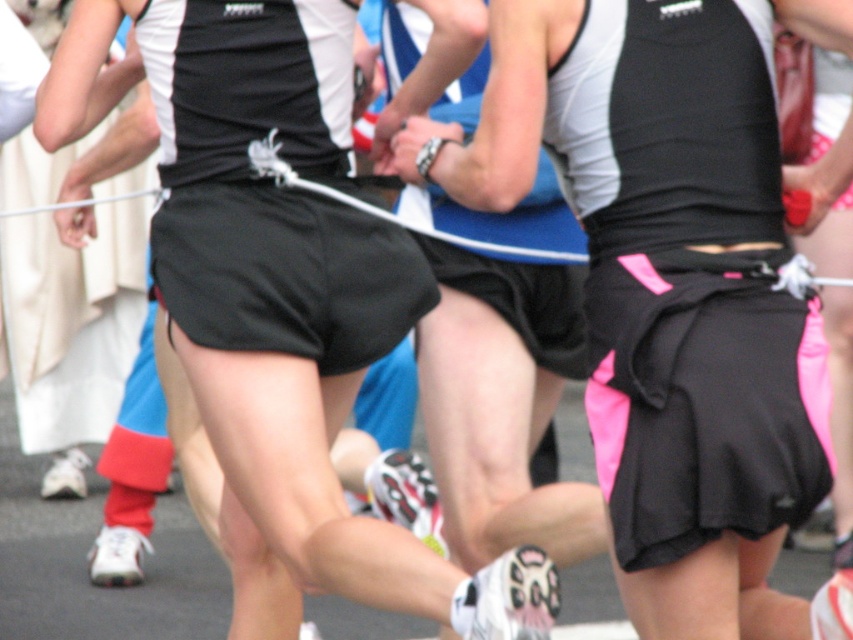
Can you confirm if black matte shorts at center is positioned to the left of black matte skirt at center?

Correct, you'll find black matte shorts at center to the left of black matte skirt at center.

Who is taller, black matte shorts at center or black matte skirt at center?

black matte shorts at center

Is point (320, 24) more distant than point (585, 115)?

Yes, it is.

You are a GUI agent. You are given a task and a screenshot of the screen. Output one action in this format:
    pyautogui.click(x=<x>, y=<y>)
    Task: Click on the black matte shorts at center
    Image resolution: width=853 pixels, height=640 pixels.
    Given the screenshot: What is the action you would take?
    pyautogui.click(x=277, y=300)